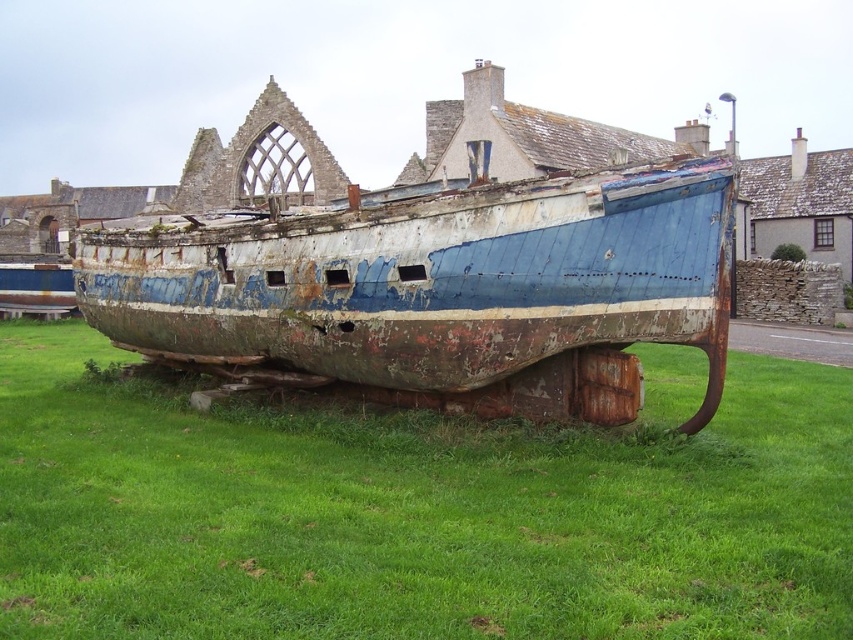
Can you confirm if green grass at center is wider than rusty metal boat at center?

Correct, the width of green grass at center exceeds that of rusty metal boat at center.

Which is more to the right, green grass at center or rusty metal boat at center?

From the viewer's perspective, green grass at center appears more on the right side.

Is point (310, 625) positioned behind point (492, 385)?

No, it is in front of (492, 385).

The image size is (853, 640). In order to click on green grass at center in this screenshot , I will do `click(418, 509)`.